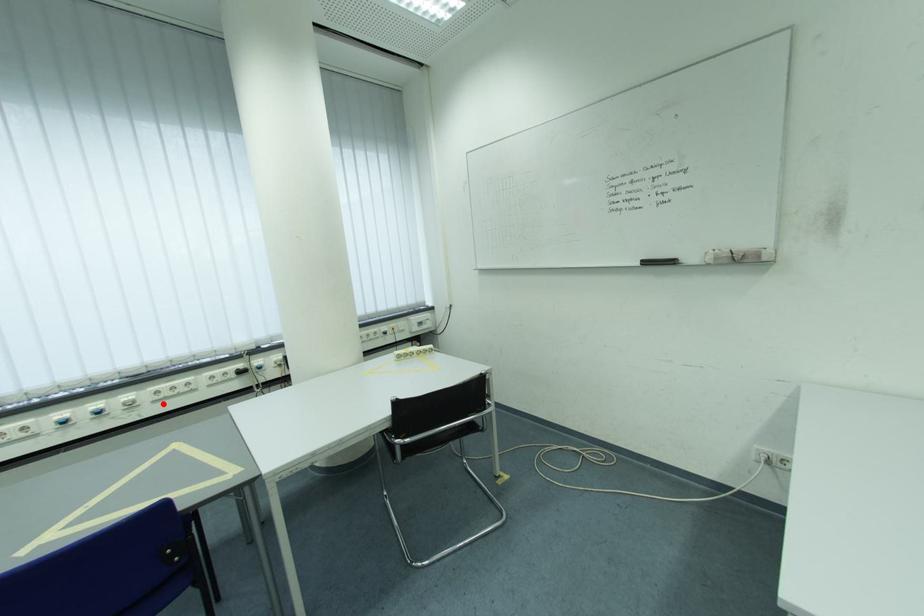
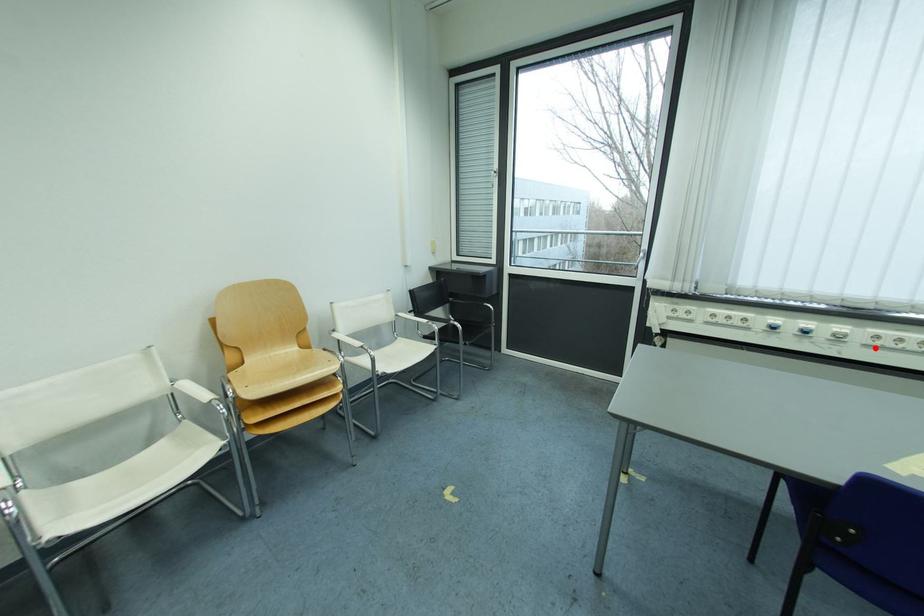
I am providing you with two images of the same scene from different viewpoints. A red point is marked on the first image and another point is marked on the second image. Is the red point in image1 aligned with the point shown in image2?

Yes